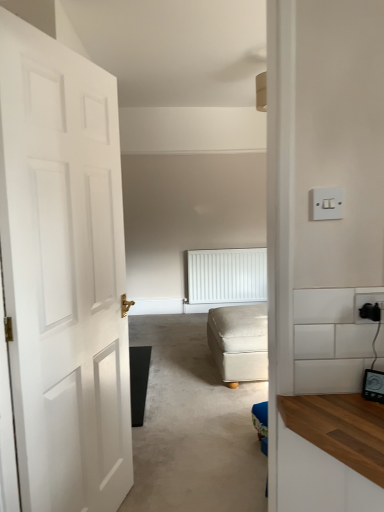
Question: Is white textured radiator at center oriented towards black plastic socket at right?

Choices:
 (A) yes
 (B) no

Answer: (A)

Question: Is white textured radiator at center at the left side of black plastic socket at right?

Choices:
 (A) no
 (B) yes

Answer: (B)

Question: From the image's perspective, is white textured radiator at center below black plastic socket at right?

Choices:
 (A) yes
 (B) no

Answer: (A)

Question: Is white textured radiator at center beside black plastic socket at right?

Choices:
 (A) no
 (B) yes

Answer: (A)

Question: Is the position of white textured radiator at center more distant than that of black plastic socket at right?

Choices:
 (A) no
 (B) yes

Answer: (B)

Question: In terms of height, does white plastic light switch at upper right look taller or shorter compared to beige fabric ottoman at center?

Choices:
 (A) tall
 (B) short

Answer: (B)

Question: In the image, is white plastic light switch at upper right positioned in front of or behind beige fabric ottoman at center?

Choices:
 (A) front
 (B) behind

Answer: (A)

Question: From the image's perspective, is white plastic light switch at upper right above or below beige fabric ottoman at center?

Choices:
 (A) above
 (B) below

Answer: (A)

Question: Considering the positions of white plastic light switch at upper right and beige fabric ottoman at center in the image, is white plastic light switch at upper right wider or thinner than beige fabric ottoman at center?

Choices:
 (A) wide
 (B) thin

Answer: (B)

Question: Would you say black plastic socket at right is to the left or to the right of white matte door at left in the picture?

Choices:
 (A) right
 (B) left

Answer: (A)

Question: From the image's perspective, is black plastic socket at right located above or below white matte door at left?

Choices:
 (A) above
 (B) below

Answer: (A)

Question: Is point (375, 291) positioned closer to the camera than point (28, 222)?

Choices:
 (A) closer
 (B) farther

Answer: (A)

Question: Is black plastic socket at right inside the boundaries of white matte door at left, or outside?

Choices:
 (A) inside
 (B) outside

Answer: (B)

Question: Is point (190, 458) closer or farther from the camera than point (201, 257)?

Choices:
 (A) farther
 (B) closer

Answer: (B)

Question: In the image, is white matte door at left on the left side or the right side of white textured radiator at center?

Choices:
 (A) right
 (B) left

Answer: (B)